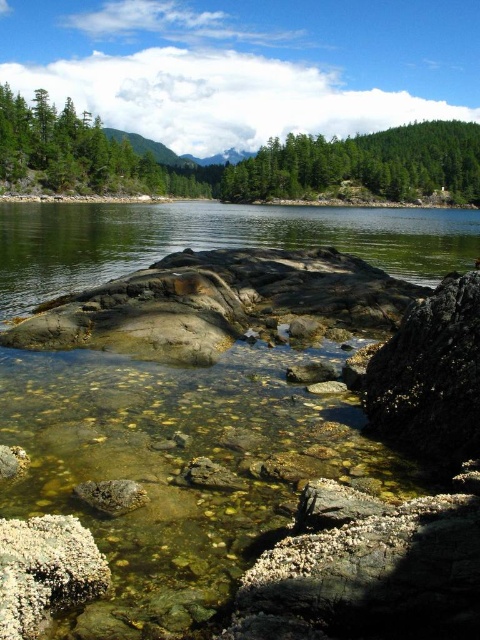
Looking at this image, which is below, smooth gray rock at center-right or green matte tree at upper right?

Positioned lower is smooth gray rock at center-right.

What do you see at coordinates (431, 376) in the screenshot?
I see `smooth gray rock at center-right` at bounding box center [431, 376].

Which is in front, point (448, 355) or point (367, 188)?

Point (448, 355)

At what (x,y) coordinates should I click in order to perform the action: click on smooth gray rock at center-right. Please return your answer as a coordinate pair (x, y). The width and height of the screenshot is (480, 640). Looking at the image, I should click on (431, 376).

Which is in front, point (399, 426) or point (76, 582)?

Point (76, 582) is in front.

Consider the image. Who is positioned more to the left, smooth gray rock at center-right or white coral-like rock at lower left?

From the viewer's perspective, white coral-like rock at lower left appears more on the left side.

Locate an element on the screen. The height and width of the screenshot is (640, 480). smooth gray rock at center-right is located at coordinates (431, 376).

Where is `smooth gray rock at center-right`? Image resolution: width=480 pixels, height=640 pixels. smooth gray rock at center-right is located at coordinates (431, 376).

Between green matte tree at upper right and white coral-like rock at lower left, which one has less height?

white coral-like rock at lower left

Between green matte tree at upper right and white coral-like rock at lower left, which one appears on the left side from the viewer's perspective?

white coral-like rock at lower left is more to the left.

Between point (295, 186) and point (20, 540), which one is positioned behind?

Positioned behind is point (295, 186).

The height and width of the screenshot is (640, 480). I want to click on green matte tree at upper right, so click(x=362, y=164).